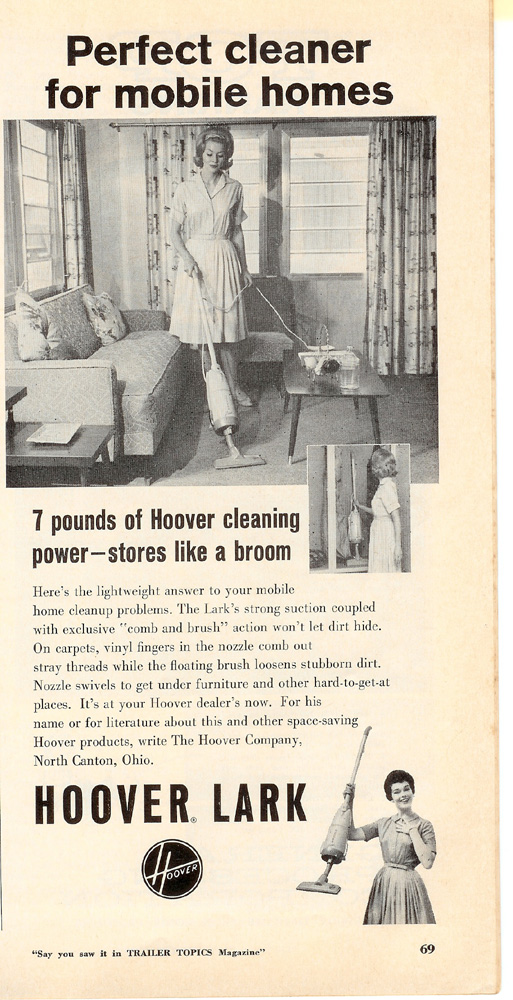
The image size is (513, 1000). What are the coordinates of `vacuum cleaners` in the screenshot? It's located at (217, 389), (337, 825), (352, 521).